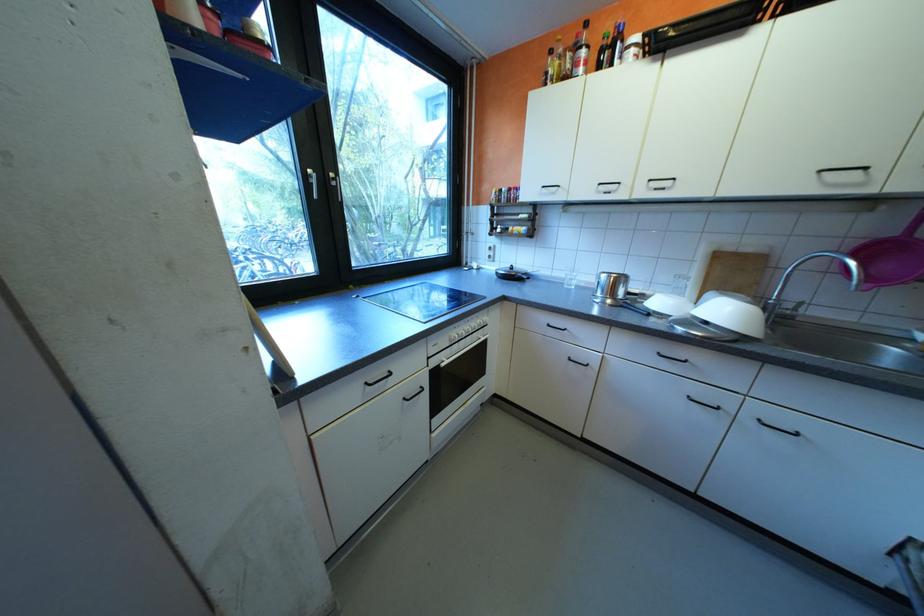
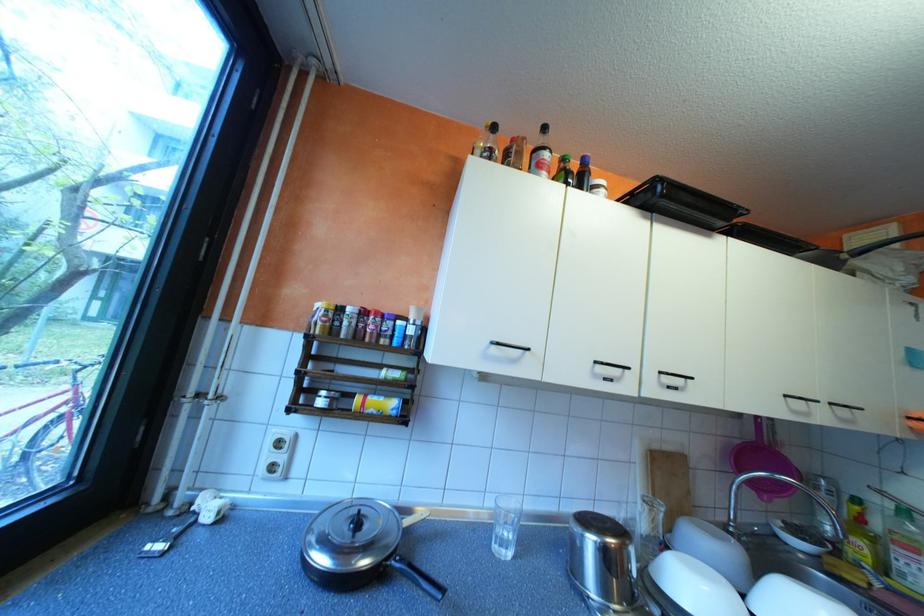
The point at (x=832, y=171) is marked in the first image. Where is the corresponding point in the second image?

(797, 395)